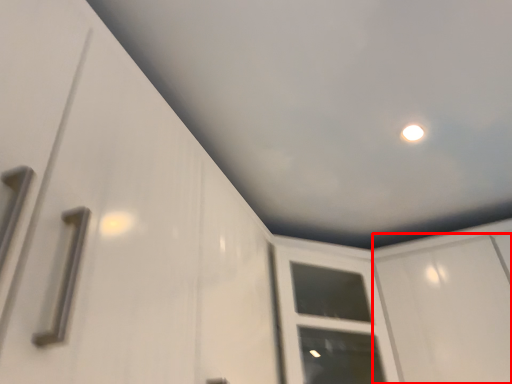
Question: From the image's perspective, what is the correct spatial positioning of screen door (annotated by the red box) in reference to window frame?

Choices:
 (A) below
 (B) above

Answer: (B)